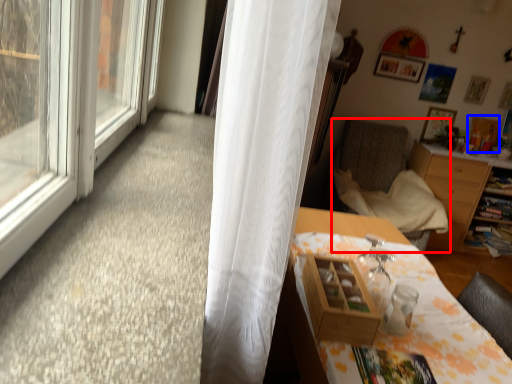
Question: Which of the following is the closest to the observer, chair (highlighted by a red box) or picture frame (highlighted by a blue box)?

Choices:
 (A) chair
 (B) picture frame

Answer: (A)